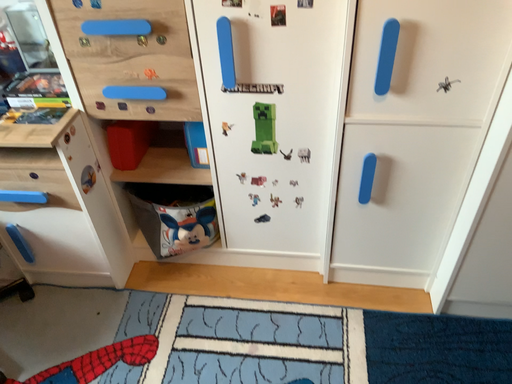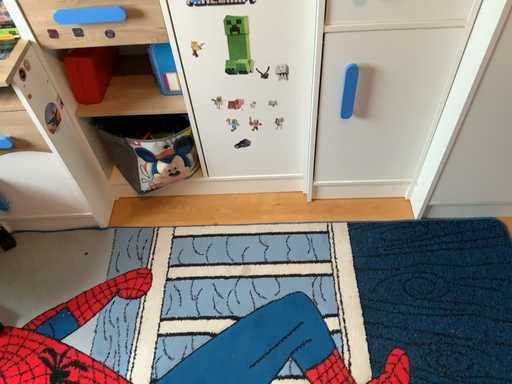
Question: How did the camera likely rotate when shooting the video?

Choices:
 (A) rotated upward
 (B) rotated downward

Answer: (B)